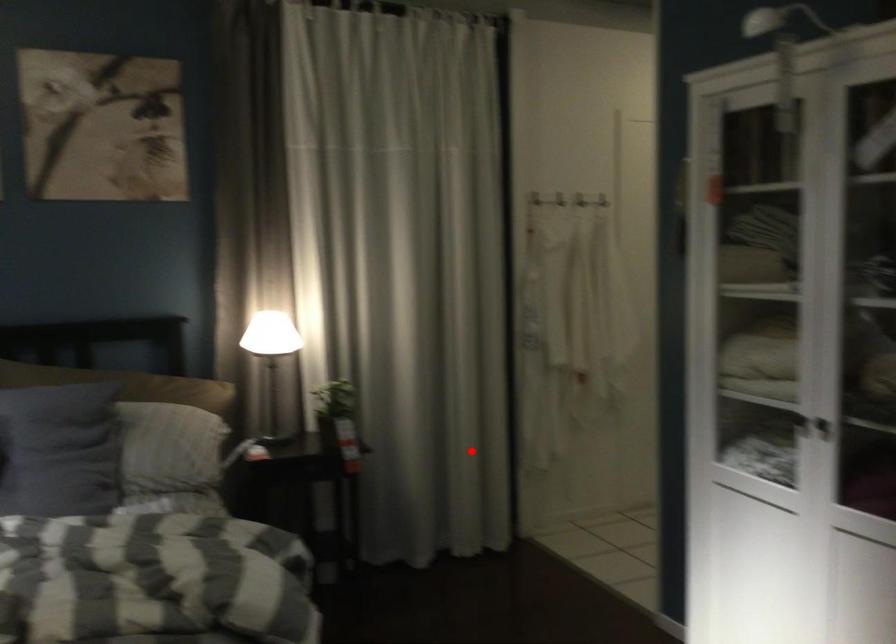
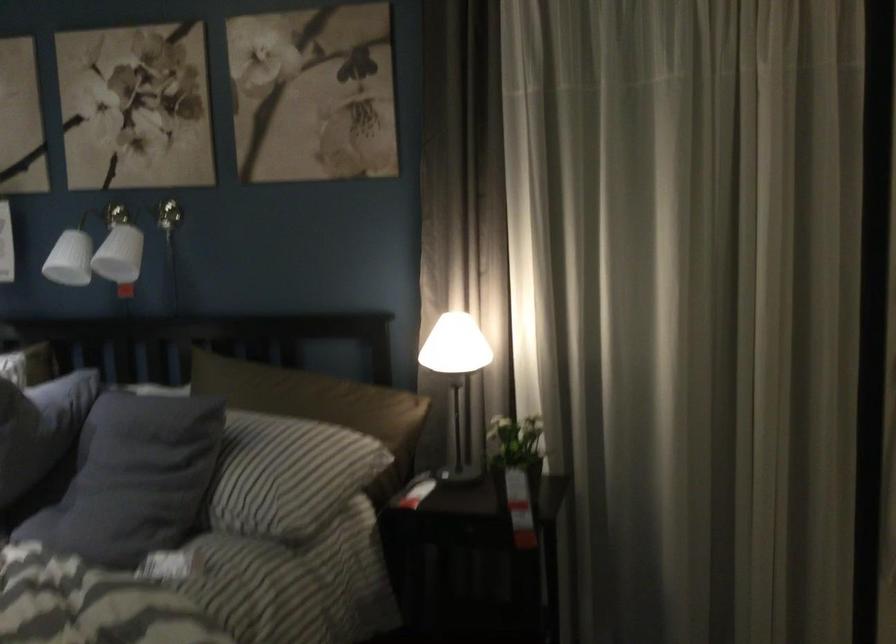
Question: A red point is marked in image1. In image2, is the corresponding 3D point closer to the camera or farther? Reply with the corresponding letter.

Choices:
 (A) The corresponding 3D point is closer.
 (B) The corresponding 3D point is farther.

Answer: (A)